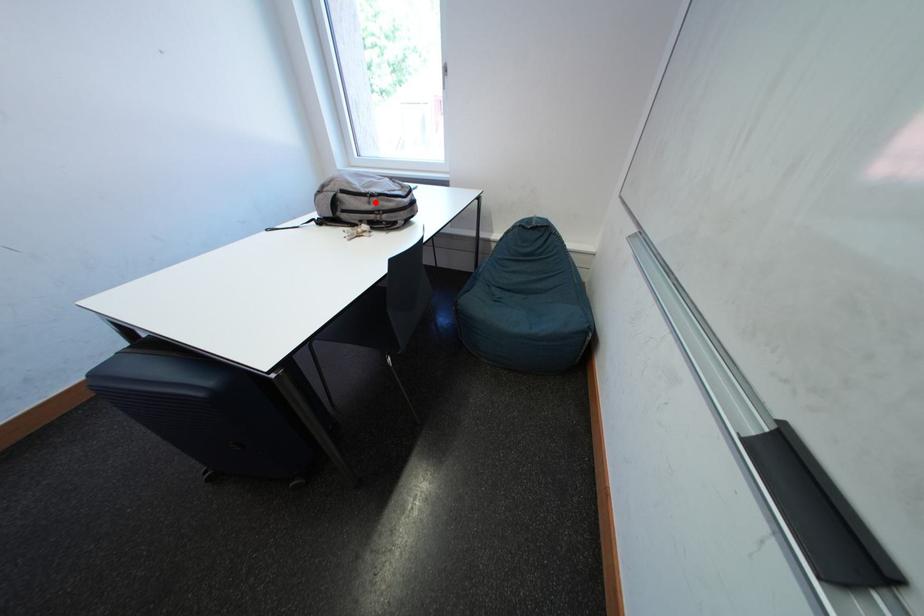
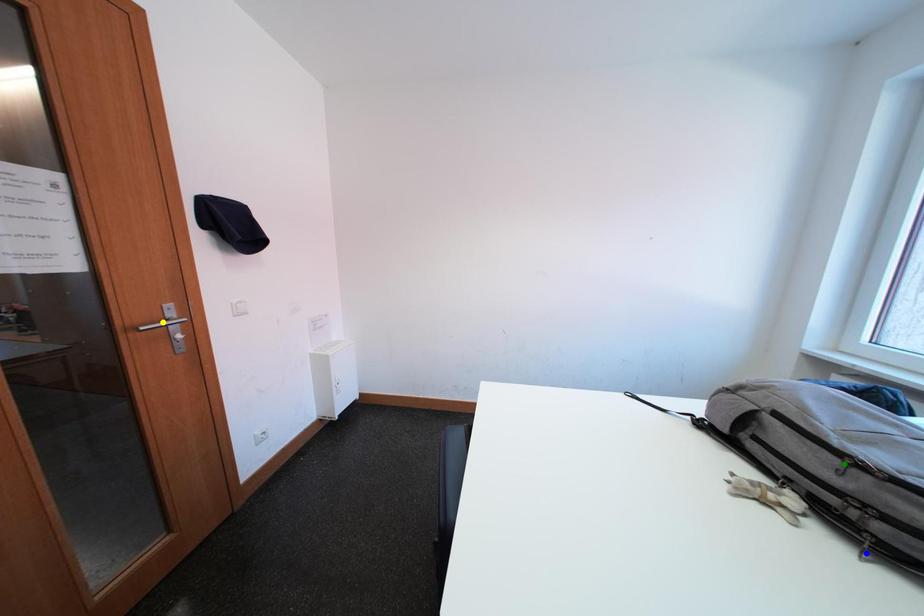
Question: I am providing you with two images of the same scene from different viewpoints. A red point is marked on the first image. You are given multiple points on the second image. Which point in image 2 is actually the same real-world point as the red point in image 1?

Choices:
 (A) yellow point
 (B) green point
 (C) blue point

Answer: (B)